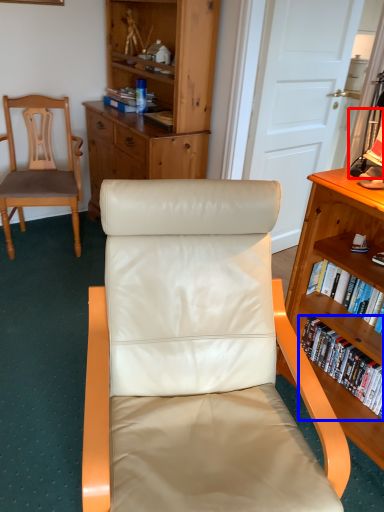
Question: Which point is further to the camera, lamp (highlighted by a red box) or book (highlighted by a blue box)?

Choices:
 (A) lamp
 (B) book

Answer: (B)